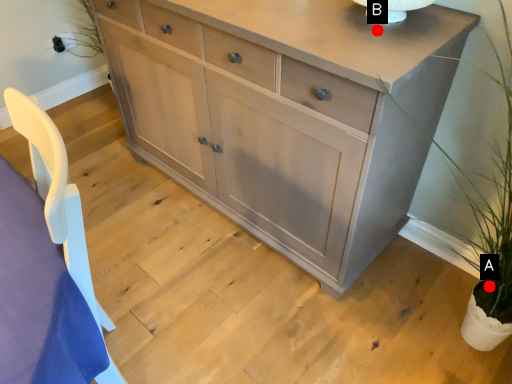
Question: Two points are circled on the image, labeled by A and B beside each circle. Among these points, which one is farthest from the camera?

Choices:
 (A) A is further
 (B) B is further

Answer: (B)